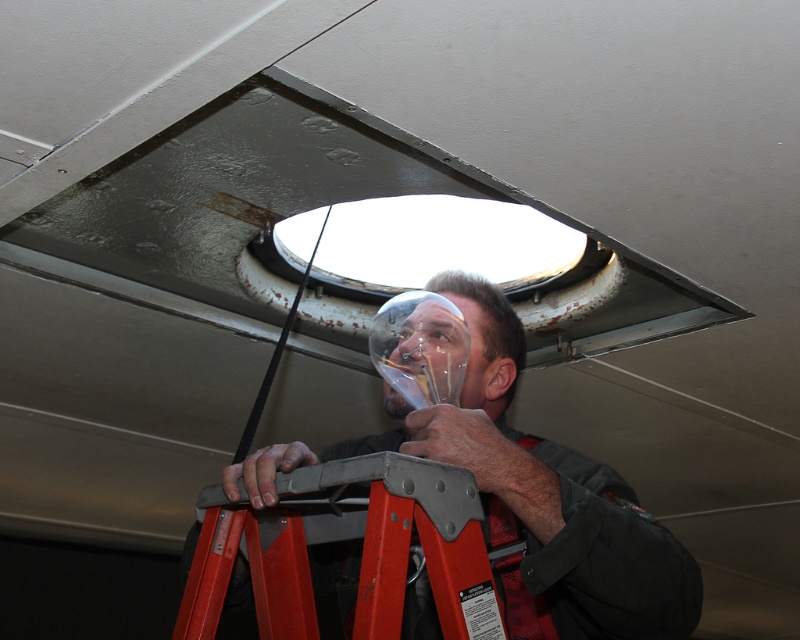
You are an electrician assessing a workspace. You notice a clear plastic lightbulb at center and a red metallic ladder at lower center. Which object is taller in the image?

The clear plastic lightbulb at center is much taller than the red metallic ladder at lower center according to the description.

You are a safety inspector checking the setup of the worker on the ladder. Based on the scene, is the clear plastic lightbulb at center positioned in a safe location relative to the red metallic ladder at lower center?

The clear plastic lightbulb at center is above the red metallic ladder at lower center, which poses a safety risk. The bulb could fall and hit the worker below, so it should be secured or the ladder moved to a safer position.

You are a worker standing at point (x=278, y=529) and need to reach point (x=660, y=576) to complete a task. Given the scene, which direction should you move to get there?

You should move forward because point (x=660, y=576) is in front of point (x=278, y=529).